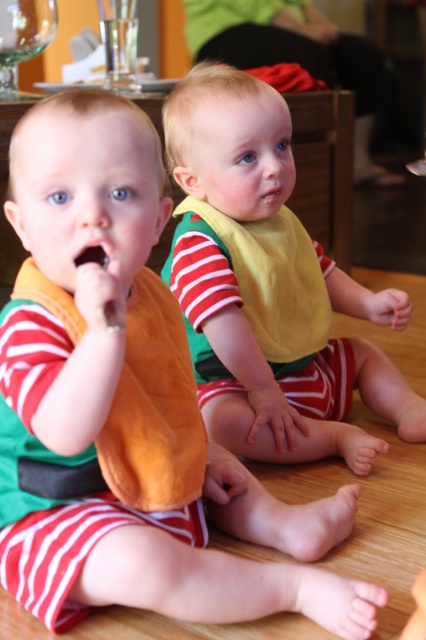
Question: Can you confirm if yellow fabric bib at center is smaller than transparent glass at upper left?

Choices:
 (A) no
 (B) yes

Answer: (A)

Question: In this image, where is yellow fabric bib at center located relative to transparent glass at upper left?

Choices:
 (A) below
 (B) above

Answer: (A)

Question: Which point is closer to the camera taking this photo?

Choices:
 (A) (333, 449)
 (B) (3, 16)

Answer: (A)

Question: Which of the following is the closest to the observer?

Choices:
 (A) (2, 58)
 (B) (180, 269)

Answer: (B)

Question: Which object appears farthest from the camera in this image?

Choices:
 (A) yellow fabric bib at center
 (B) transparent glass at upper left

Answer: (B)

Question: Does yellow fabric bib at center lie behind transparent glass at upper left?

Choices:
 (A) yes
 (B) no

Answer: (B)